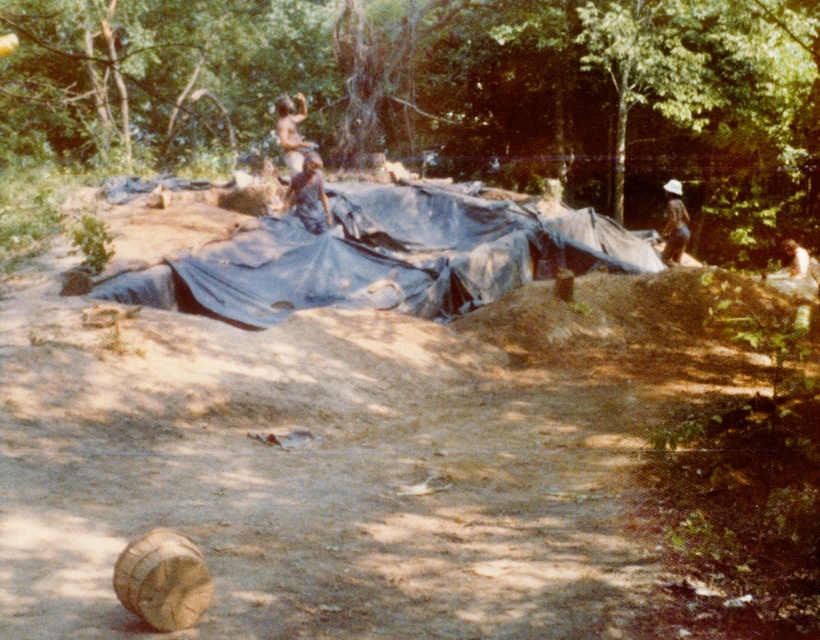
Is brown sandy dirt field at center shorter than brown skin person at upper center?

Correct, brown sandy dirt field at center is not as tall as brown skin person at upper center.

Who is lower down, brown sandy dirt field at center or brown skin person at upper center?

brown sandy dirt field at center

The height and width of the screenshot is (640, 820). Identify the location of brown sandy dirt field at center. (347, 460).

In order to click on brown sandy dirt field at center in this screenshot , I will do click(347, 460).

Locate an element on the screen. This screenshot has height=640, width=820. brown sandy dirt field at center is located at coordinates (347, 460).

Which is behind, point (645, 248) or point (317, 172)?

The point (645, 248) is behind.

Locate an element on the screen. Image resolution: width=820 pixels, height=640 pixels. brown sandy dirt field at center is located at coordinates (347, 460).

Which is more to the left, brown sandy dirt field at center or brown fabric hat at upper right?

brown sandy dirt field at center is more to the left.

Is brown sandy dirt field at center smaller than brown fabric hat at upper right?

No, brown sandy dirt field at center is not smaller than brown fabric hat at upper right.

Is point (418, 525) behind point (672, 198)?

No, it is not.

Locate an element on the screen. brown sandy dirt field at center is located at coordinates (347, 460).